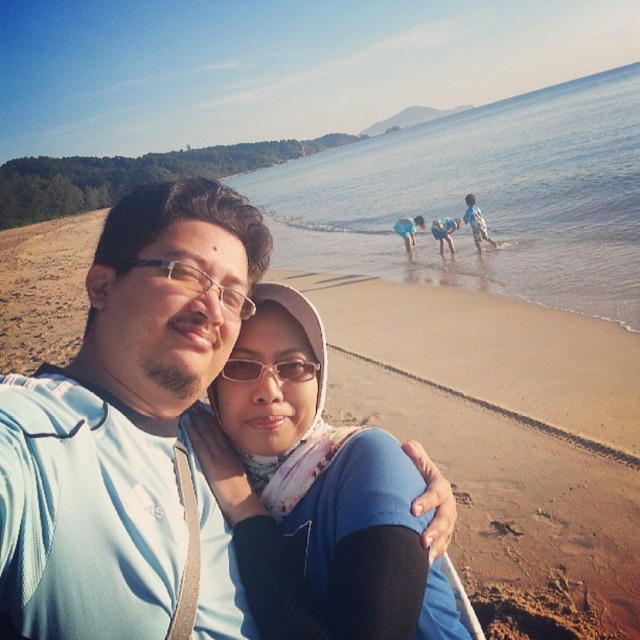
You are a photographer trying to capture the entire scene of the brown sandy beach at lower center and the matte black glasses at center. Which object would you need to focus on first if you want to ensure both are in frame?

The brown sandy beach at lower center is wider than the matte black glasses at center, so you should focus on the wider area first to ensure both fit in the frame.

You are a photographer trying to capture a closeup of the transparent plastic glasses at center and the matte blue scarf at center. Which object should you focus on first if you want to ensure both are in focus?

The matte blue scarf at center is below transparent plastic glasses at center, so you should focus on the transparent plastic glasses at center first to ensure both are in focus.

You are standing on the beach and want to take a photo of the point at coordinates (401,140). If your camera has a maximum focus range of 120 meters, will it be able to focus on that point?

The distance of point (401,140) from viewer is 121.32 meters, which is beyond the camera maximum focus range of 120 meters. So the camera cannot focus on that point.